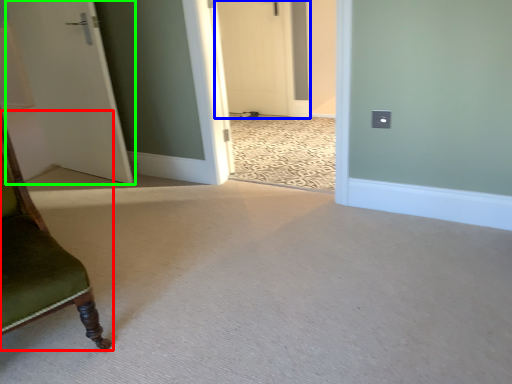
Question: Which is farther away from furniture (highlighted by a red box)? door (highlighted by a blue box) or door (highlighted by a green box)?

Choices:
 (A) door
 (B) door

Answer: (A)